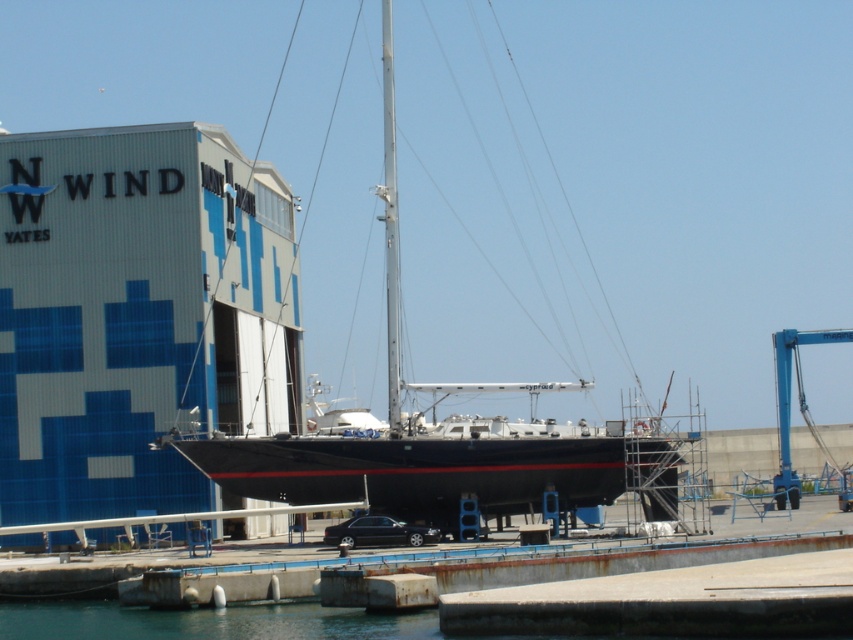
Which is above, black glossy sailboat at center or silver metallic mast at center?

Positioned higher is silver metallic mast at center.

This screenshot has width=853, height=640. Identify the location of black glossy sailboat at center. (457, 472).

Where is `black glossy sailboat at center`? Image resolution: width=853 pixels, height=640 pixels. black glossy sailboat at center is located at coordinates 457,472.

Is transparent blue water at lower left taller than blue metallic crane at right?

No, transparent blue water at lower left is not taller than blue metallic crane at right.

Can you confirm if transparent blue water at lower left is smaller than blue metallic crane at right?

Yes, transparent blue water at lower left is smaller than blue metallic crane at right.

Is point (59, 611) farther from camera compared to point (778, 429)?

That is False.

The image size is (853, 640). Find the location of `transparent blue water at lower left`. transparent blue water at lower left is located at coordinates (209, 621).

Does black glossy sailboat at center have a lesser height compared to transparent blue water at lower left?

Incorrect, black glossy sailboat at center's height does not fall short of transparent blue water at lower left's.

Who is higher up, black glossy sailboat at center or transparent blue water at lower left?

transparent blue water at lower left is above.

This screenshot has width=853, height=640. What are the coordinates of `black glossy sailboat at center` in the screenshot? It's located at (457, 472).